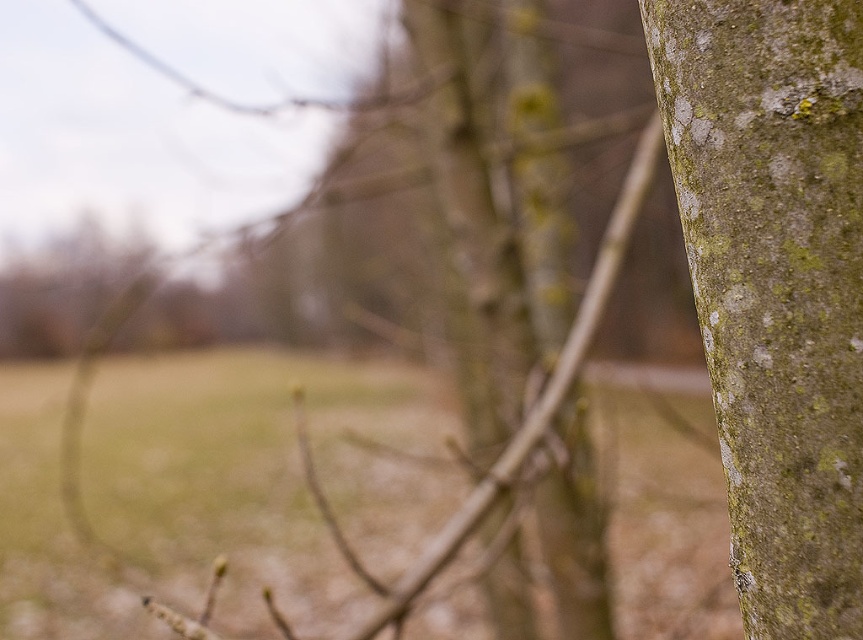
You are standing in front of a tree trunk. You notice two areas with green mossy bark. One is labeled as green mossy bark at right and the other as green mossy bark at upper right. Which one is positioned more to the right side of the tree trunk?

The green mossy bark at right is positioned more to the right side of the tree trunk compared to the green mossy bark at upper right.

You are an observer looking at the tree trunk. Which part of the green mossy bark is lower down on the tree trunk, the green mossy bark at right or the green mossy bark at upper right?

The green mossy bark at right is positioned under the green mossy bark at upper right, so the green mossy bark at right is lower down on the tree trunk.